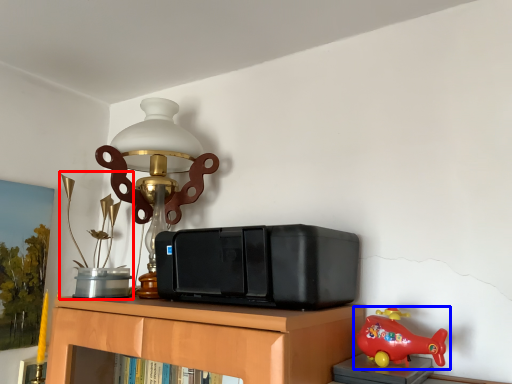
Question: Which of the following is the closest to the observer, toy (highlighted by a red box) or toy (highlighted by a blue box)?

Choices:
 (A) toy
 (B) toy

Answer: (B)